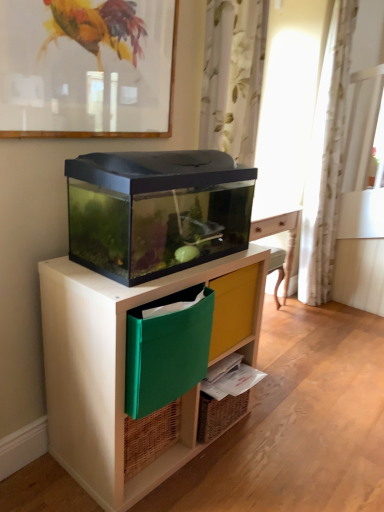
Question: From the image's perspective, is white floral fabric curtain at upper center, the first curtain when ordered from front to back, under matte black aquarium at center?

Choices:
 (A) yes
 (B) no

Answer: (B)

Question: Does white floral fabric curtain at upper center, which is counted as the 2th curtain, starting from the right, appear on the right side of matte black aquarium at center?

Choices:
 (A) no
 (B) yes

Answer: (B)

Question: From a real-world perspective, is white floral fabric curtain at upper center, the first curtain when ordered from front to back, over matte black aquarium at center?

Choices:
 (A) no
 (B) yes

Answer: (B)

Question: Is white floral fabric curtain at upper center, the first curtain when ordered from front to back, positioned in front of matte black aquarium at center?

Choices:
 (A) yes
 (B) no

Answer: (B)

Question: Is white floral fabric curtain at upper center, which is counted as the 1th curtain, starting from the left, aimed at matte black aquarium at center?

Choices:
 (A) yes
 (B) no

Answer: (B)

Question: Looking at the image, does matte glass picture frame at upper center seem bigger or smaller compared to white floral fabric curtain at upper center, the second curtain from the back?

Choices:
 (A) big
 (B) small

Answer: (B)

Question: From the image's perspective, is matte glass picture frame at upper center located above or below white floral fabric curtain at upper center, which is counted as the 1th curtain, starting from the left?

Choices:
 (A) above
 (B) below

Answer: (A)

Question: Is matte glass picture frame at upper center taller or shorter than white floral fabric curtain at upper center, which is counted as the 1th curtain, starting from the left?

Choices:
 (A) short
 (B) tall

Answer: (A)

Question: Considering the positions of matte glass picture frame at upper center and white floral fabric curtain at upper center, the first curtain when ordered from front to back, in the image, is matte glass picture frame at upper center wider or thinner than white floral fabric curtain at upper center, the first curtain when ordered from front to back,?

Choices:
 (A) wide
 (B) thin

Answer: (B)

Question: Looking at their shapes, would you say green fabric file at lower center is wider or thinner than matte black aquarium at center?

Choices:
 (A) wide
 (B) thin

Answer: (B)

Question: From the image's perspective, is green fabric file at lower center located above or below matte black aquarium at center?

Choices:
 (A) below
 (B) above

Answer: (B)

Question: Is point (163, 312) closer or farther from the camera than point (125, 302)?

Choices:
 (A) closer
 (B) farther

Answer: (B)

Question: From their relative heights in the image, would you say green fabric file at lower center is taller or shorter than matte black aquarium at center?

Choices:
 (A) tall
 (B) short

Answer: (B)

Question: Considering the positions of white floral fabric curtain at upper center, which is counted as the 1th curtain, starting from the left, and green fabric file at lower center in the image, is white floral fabric curtain at upper center, which is counted as the 1th curtain, starting from the left, taller or shorter than green fabric file at lower center?

Choices:
 (A) short
 (B) tall

Answer: (B)

Question: Is white floral fabric curtain at upper center, the second curtain from the back, in front of or behind green fabric file at lower center in the image?

Choices:
 (A) front
 (B) behind

Answer: (B)